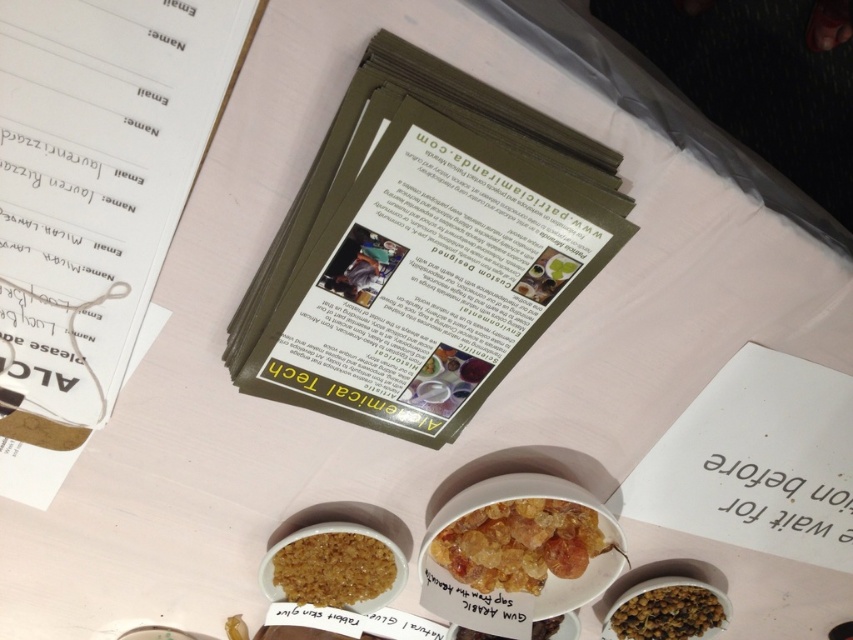
You are organizing materials on a table for an event. You have a translucent amber crystals at center and a brown crumbly substance at center. According to the setup, which item is placed on top of the other?

The translucent amber crystals at center is positioned over brown crumbly substance at center, meaning it is placed on top of the brown crumbly substance at center.

You are organizing a science fair and need to arrange two substances for an exhibit. You have a translucent amber crystals at center and a brown crumbly substance at center. According to the image, which substance is located to the right of the other?

The translucent amber crystals at center is positioned on the right side of brown crumbly substance at center, so the translucent amber crystals at center is to the right of the brown crumbly substance at center.